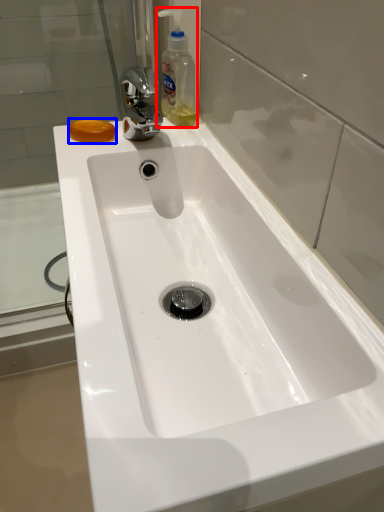
Question: Which of the following is the farthest to the observer, cleaning product (highlighted by a red box) or soap (highlighted by a blue box)?

Choices:
 (A) cleaning product
 (B) soap

Answer: (B)